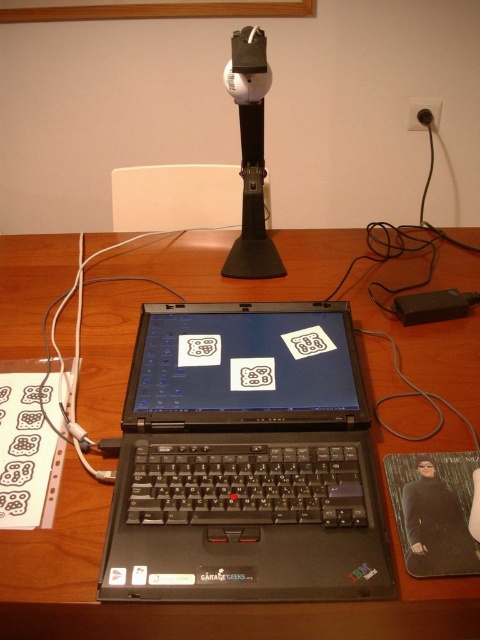
Does wooden table at center come behind black plastic laptop at center?

Yes, it is.

Where is `wooden table at center`? This screenshot has height=640, width=480. wooden table at center is located at coordinates (213, 604).

Is black plastic laptop at center wider than white matte microphone at upper center?

Correct, the width of black plastic laptop at center exceeds that of white matte microphone at upper center.

Can you confirm if black plastic laptop at center is taller than white matte microphone at upper center?

In fact, black plastic laptop at center may be shorter than white matte microphone at upper center.

Who is more forward, (226, 547) or (262, 125)?

Positioned in front is point (226, 547).

Locate an element on the screen. The width and height of the screenshot is (480, 640). black plastic laptop at center is located at coordinates (244, 460).

Who is higher up, wooden table at center or white matte microphone at upper center?

white matte microphone at upper center

Is wooden table at center above white matte microphone at upper center?

Incorrect, wooden table at center is not positioned above white matte microphone at upper center.

Where is `wooden table at center`? Image resolution: width=480 pixels, height=640 pixels. wooden table at center is located at coordinates (213, 604).

Identify the location of wooden table at center. (213, 604).